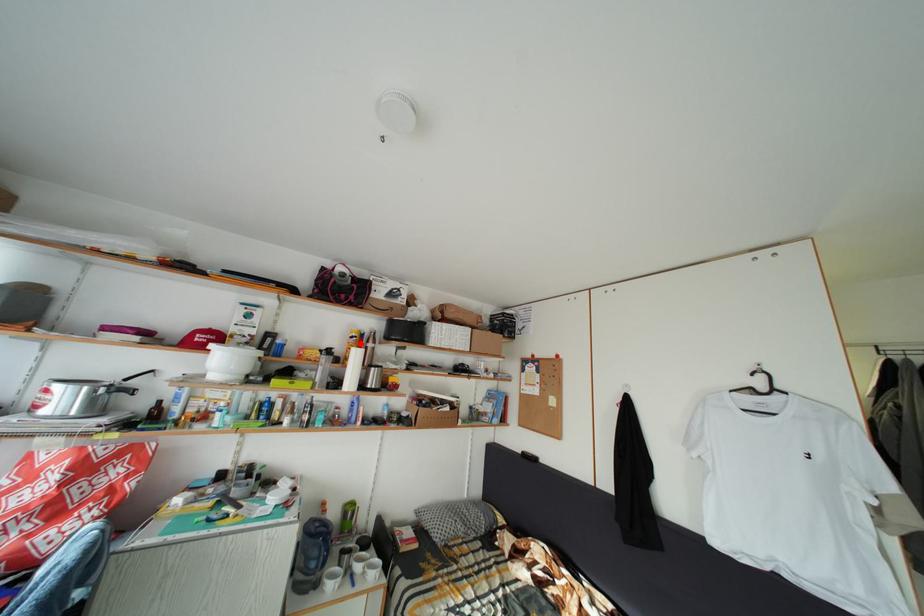
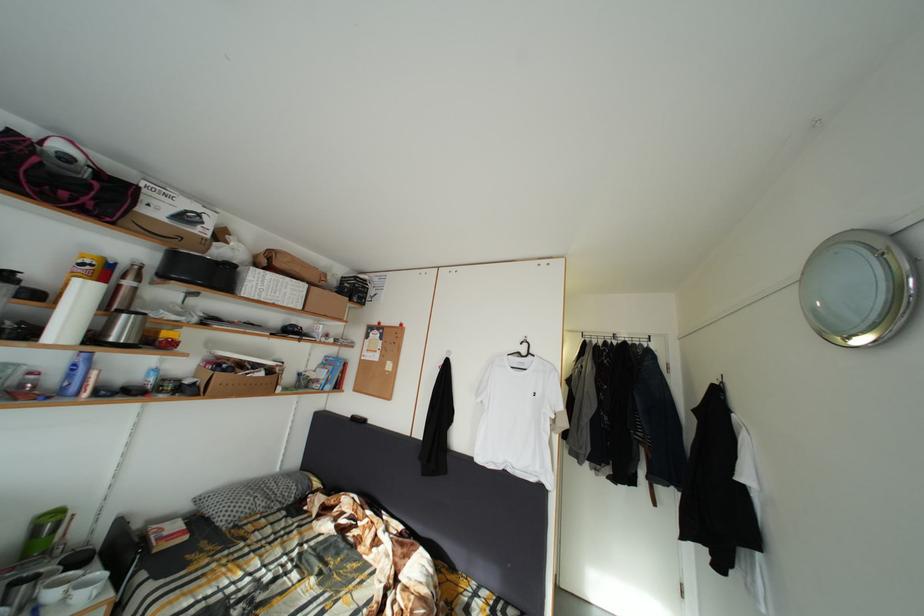
The point at the highlighted location is marked in the first image. Where is the corresponding point in the second image?

(91, 270)